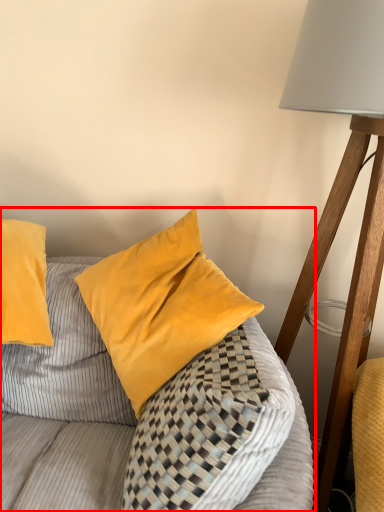
Question: From the image's perspective, considering the relative positions of furniture (annotated by the red box) and lamp in the image provided, where is furniture (annotated by the red box) located with respect to the staircase?

Choices:
 (A) above
 (B) below

Answer: (B)